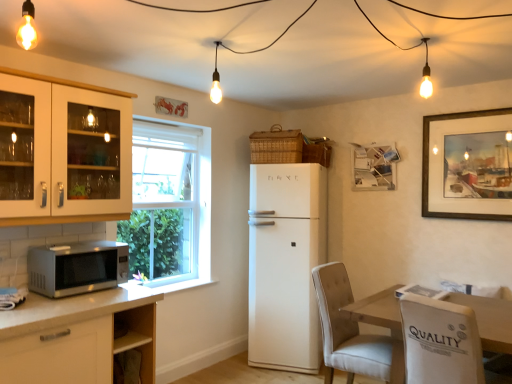
Question: From a real-world perspective, is woven brown basket at upper center, the 1th basket viewed from the right, above or below white glass cabinet at left?

Choices:
 (A) above
 (B) below

Answer: (A)

Question: Is woven brown basket at upper center, placed as the second basket when sorted from left to right, wider or thinner than white glass cabinet at left?

Choices:
 (A) wide
 (B) thin

Answer: (B)

Question: Which object is positioned farthest from the white fabric chair at lower right?

Choices:
 (A) white matte refrigerator at center
 (B) white glass cabinet at left
 (C) woven brown basket at upper center, placed as the 2th basket when sorted from right to left
 (D) wooden table at lower right
 (E) wooden framed painting at upper right

Answer: (B)

Question: Which object is positioned farthest from the woven brown basket at upper center, placed as the second basket when sorted from left to right?

Choices:
 (A) wooden framed painting at upper right
 (B) satin silver microwave at lower left
 (C) wooden table at lower right
 (D) woven brown basket at upper center, placed as the 2th basket when sorted from right to left
 (E) white fabric chair at lower right

Answer: (B)